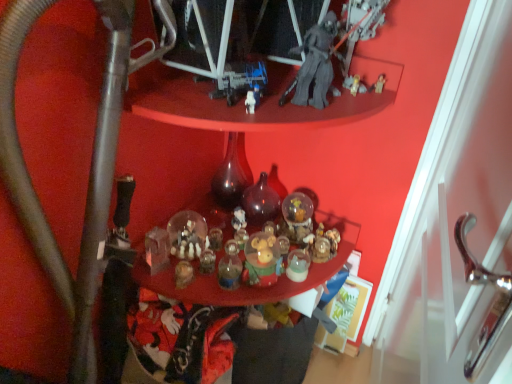
Question: From the image's perspective, is translucent dark glass bottle at center, placed as the 1th bottle when sorted from right to left, on top of translucent glass ornaments at center?

Choices:
 (A) yes
 (B) no

Answer: (A)

Question: Are translucent dark glass bottle at center, positioned as the second bottle in left-to-right order, and translucent glass ornaments at center located far from each other?

Choices:
 (A) no
 (B) yes

Answer: (A)

Question: Is translucent dark glass bottle at center, positioned as the second bottle in left-to-right order, bigger than translucent glass ornaments at center?

Choices:
 (A) no
 (B) yes

Answer: (A)

Question: Does translucent dark glass bottle at center, placed as the 1th bottle when sorted from right to left, have a greater width compared to translucent glass ornaments at center?

Choices:
 (A) no
 (B) yes

Answer: (A)

Question: Is the position of translucent dark glass bottle at center, positioned as the second bottle in left-to-right order, less distant than that of translucent glass ornaments at center?

Choices:
 (A) no
 (B) yes

Answer: (A)

Question: Does translucent dark glass bottle at center, positioned as the second bottle in left-to-right order, appear on the left side of translucent glass ornaments at center?

Choices:
 (A) yes
 (B) no

Answer: (B)

Question: Is translucent dark glass bottle at center, positioned as the second bottle in left-to-right order, smaller than metallic gray water pipe at lower left?

Choices:
 (A) yes
 (B) no

Answer: (A)

Question: Can you confirm if translucent dark glass bottle at center, positioned as the second bottle in left-to-right order, is taller than metallic gray water pipe at lower left?

Choices:
 (A) no
 (B) yes

Answer: (A)

Question: From a real-world perspective, is translucent dark glass bottle at center, positioned as the second bottle in left-to-right order, positioned under metallic gray water pipe at lower left based on gravity?

Choices:
 (A) no
 (B) yes

Answer: (A)

Question: Is translucent dark glass bottle at center, placed as the 1th bottle when sorted from right to left, to the left of metallic gray water pipe at lower left from the viewer's perspective?

Choices:
 (A) yes
 (B) no

Answer: (B)

Question: From the image's perspective, is translucent dark glass bottle at center, placed as the 1th bottle when sorted from right to left, located beneath metallic gray water pipe at lower left?

Choices:
 (A) yes
 (B) no

Answer: (B)

Question: Can you confirm if translucent dark glass bottle at center, placed as the 1th bottle when sorted from right to left, is wider than metallic gray water pipe at lower left?

Choices:
 (A) no
 (B) yes

Answer: (A)

Question: Is metallic gray water pipe at lower left positioned far away from translucent dark glass bottle at center, positioned as the second bottle in left-to-right order?

Choices:
 (A) yes
 (B) no

Answer: (B)